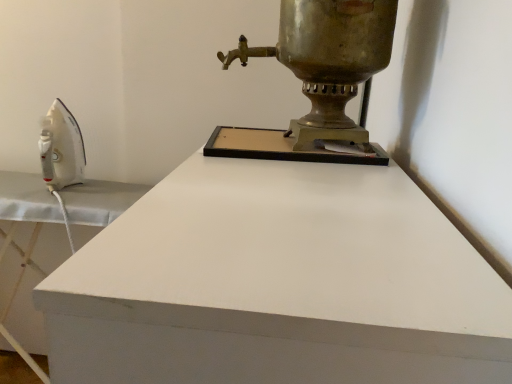
Question: From the image's perspective, does shiny brass samovar at upper right appear lower than white glossy ironing board at left?

Choices:
 (A) no
 (B) yes

Answer: (A)

Question: From a real-world perspective, is shiny brass samovar at upper right located higher than white glossy ironing board at left?

Choices:
 (A) yes
 (B) no

Answer: (A)

Question: From a real-world perspective, does shiny brass samovar at upper right sit lower than white glossy ironing board at left?

Choices:
 (A) no
 (B) yes

Answer: (A)

Question: Is shiny brass samovar at upper right oriented away from white glossy ironing board at left?

Choices:
 (A) no
 (B) yes

Answer: (A)

Question: Could you tell me if shiny brass samovar at upper right is facing white glossy ironing board at left?

Choices:
 (A) no
 (B) yes

Answer: (A)

Question: Can you confirm if shiny brass samovar at upper right is shorter than white glossy ironing board at left?

Choices:
 (A) yes
 (B) no

Answer: (A)

Question: From the image's perspective, is white glossy ironing board at left over shiny brass samovar at upper right?

Choices:
 (A) yes
 (B) no

Answer: (B)

Question: Is white glossy ironing board at left outside of shiny brass samovar at upper right?

Choices:
 (A) yes
 (B) no

Answer: (A)

Question: Can you confirm if white glossy ironing board at left is wider than shiny brass samovar at upper right?

Choices:
 (A) yes
 (B) no

Answer: (A)

Question: Is the depth of white glossy ironing board at left less than that of shiny brass samovar at upper right?

Choices:
 (A) no
 (B) yes

Answer: (B)

Question: From a real-world perspective, does white glossy ironing board at left sit lower than shiny brass samovar at upper right?

Choices:
 (A) no
 (B) yes

Answer: (B)

Question: Is shiny brass samovar at upper right at the back of white glossy ironing board at left?

Choices:
 (A) no
 (B) yes

Answer: (A)

Question: Is shiny brass samovar at upper right in front of or behind white glossy ironing board at left in the image?

Choices:
 (A) front
 (B) behind

Answer: (B)